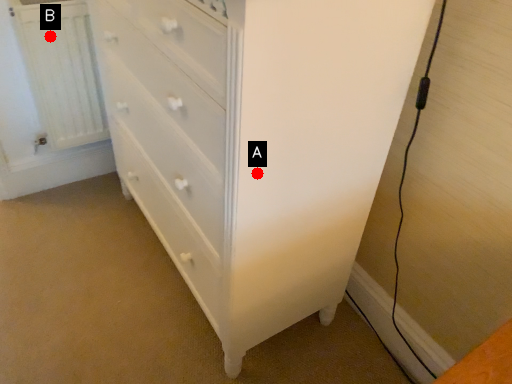
Question: Two points are circled on the image, labeled by A and B beside each circle. Which point appears farthest from the camera in this image?

Choices:
 (A) A is further
 (B) B is further

Answer: (B)